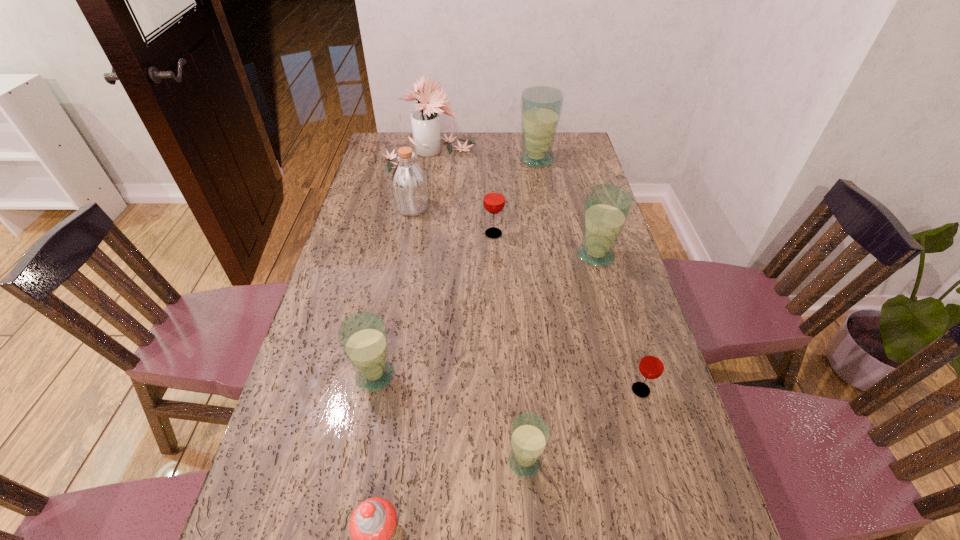
Find the location of a particular element. the right red glass is located at coordinates (651, 366).

I want to click on the nearer red glass, so click(651, 366).

Image resolution: width=960 pixels, height=540 pixels. I want to click on the nearest glass, so click(529, 434).

Find the location of a particular element. The width and height of the screenshot is (960, 540). the second nearest object is located at coordinates (529, 434).

Locate an element on the screen. blank space located on the right of the white bouquet is located at coordinates (556, 153).

Where is `vacant space situated 0.180m on the front of the tallest glass`? The image size is (960, 540). vacant space situated 0.180m on the front of the tallest glass is located at coordinates (542, 197).

Image resolution: width=960 pixels, height=540 pixels. Identify the location of free space located 0.320m on the back of the second biggest blue glass. (577, 187).

I want to click on vacant space located 0.060m on the right of the bottle, so click(x=446, y=207).

You are a GUI agent. You are given a task and a screenshot of the screen. Output one action in this format:
    pyautogui.click(x=<x>, y=<y>)
    Task: Click on the vacant space situated on the front of the bigger red glass
    This screenshot has height=540, width=960.
    Given the screenshot: What is the action you would take?
    pyautogui.click(x=494, y=251)

Locate an element on the screen. This screenshot has height=540, width=960. vacant space located on the right of the third biggest blue glass is located at coordinates (425, 376).